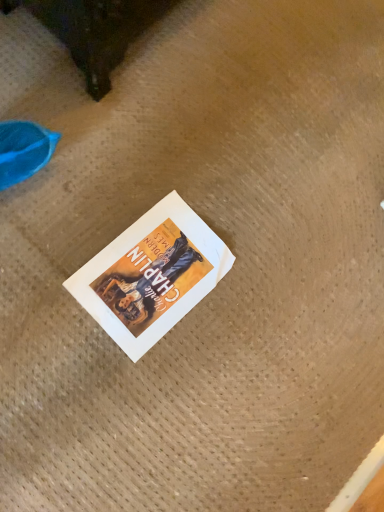
At what (x,y) coordinates should I click in order to perform the action: click on white paper book at center. Please return your answer as a coordinate pair (x, y). The width and height of the screenshot is (384, 512). Looking at the image, I should click on 151,275.

What do you see at coordinates (151, 275) in the screenshot? I see `white paper book at center` at bounding box center [151, 275].

The image size is (384, 512). Find the location of `white paper book at center`. white paper book at center is located at coordinates (151, 275).